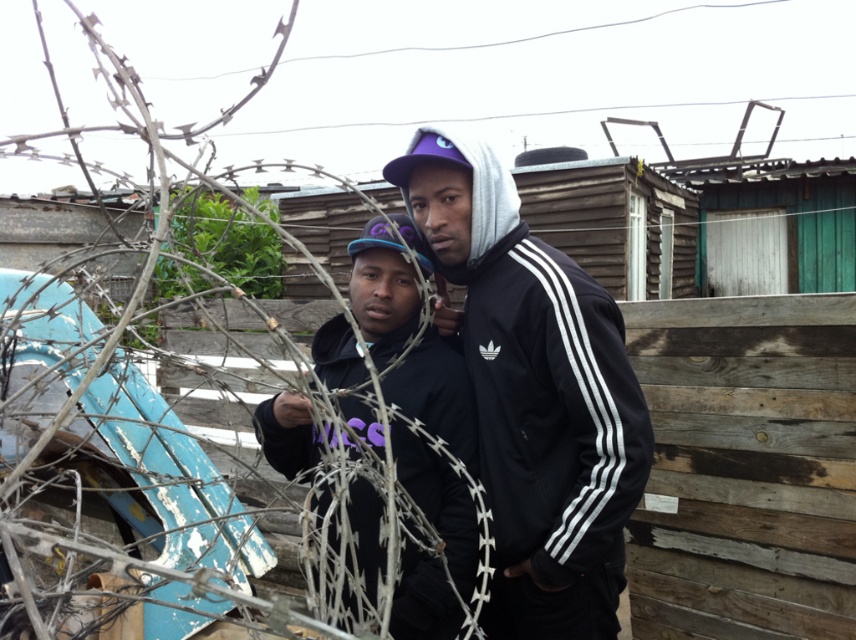
You are a photographer trying to capture both the matte black jacket at center and the black matte hoodie at center in a single shot. Since you want both to be clearly visible, will the barbed wire fence interfere with your photo?

The matte black jacket at center is closer to you than the black matte hoodie at center. Since the barbed wire fence is in the foreground, it may block the view of the black matte hoodie at center but not the matte black jacket at center.

Consider the image. You are a delivery person with a cart that is 1.8 meters wide. You need to pass through an opening between the weathered wood fence at right and another structure. The opening is 2 meters wide. Can your cart fit through?

The opening between the weathered wood fence at right and the other structure is 2 meters wide. Since your cart is 1.8 meters wide, it can fit through the opening as it is narrower than the opening.

You are a delivery person trying to see if the black matte hoodie at center is visible from the other side of the weathered wood fence at right. Can you see it clearly?

The black matte hoodie at center is behind the weathered wood fence at right, so it might be partially or fully obscured by the fence, making it difficult to see clearly from the other side.